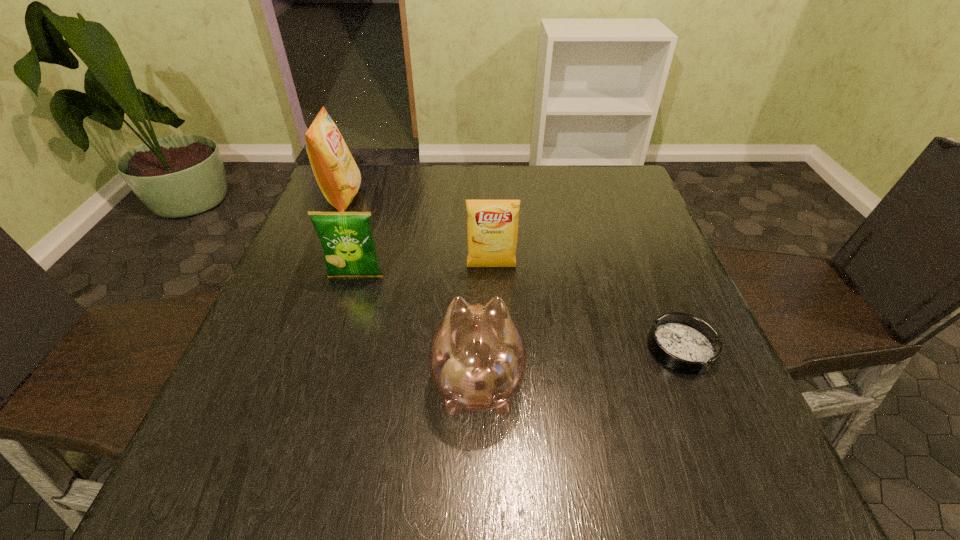
Identify the location of the third closest object to the rightmost crisp (potato chip). This screenshot has width=960, height=540. (685, 343).

Find the location of a particular element. Image resolution: width=960 pixels, height=540 pixels. crisp (potato chip) that is the closest to the rightmost crisp (potato chip) is located at coordinates pos(349,248).

Locate an element on the screen. The image size is (960, 540). crisp (potato chip) that stands as the closest to the rightmost crisp (potato chip) is located at coordinates (349, 248).

Identify the location of vacant space that satisfies the following two spatial constraints: 1. on the front facing side of the piggy bank; 2. on the right side of the shortest object. This screenshot has height=540, width=960. (478, 348).

At what (x,y) coordinates should I click in order to perform the action: click on free space that satisfies the following two spatial constraints: 1. on the front-facing side of the farthest crisp (potato chip); 2. on the right side of the rightmost object. Please return your answer as a coordinate pair (x, y). The height and width of the screenshot is (540, 960). Looking at the image, I should click on (281, 348).

The width and height of the screenshot is (960, 540). What are the coordinates of `free spot that satisfies the following two spatial constraints: 1. on the front-facing side of the tallest crisp (potato chip); 2. on the front facing side of the piggy bank` in the screenshot? It's located at (268, 381).

You are a GUI agent. You are given a task and a screenshot of the screen. Output one action in this format:
    pyautogui.click(x=<x>, y=<y>)
    Task: Click on the vacant space that satisfies the following two spatial constraints: 1. on the front of the shortest object with the logo; 2. on the left side of the rightmost crisp (potato chip)
    The height and width of the screenshot is (540, 960).
    Given the screenshot: What is the action you would take?
    pyautogui.click(x=493, y=348)